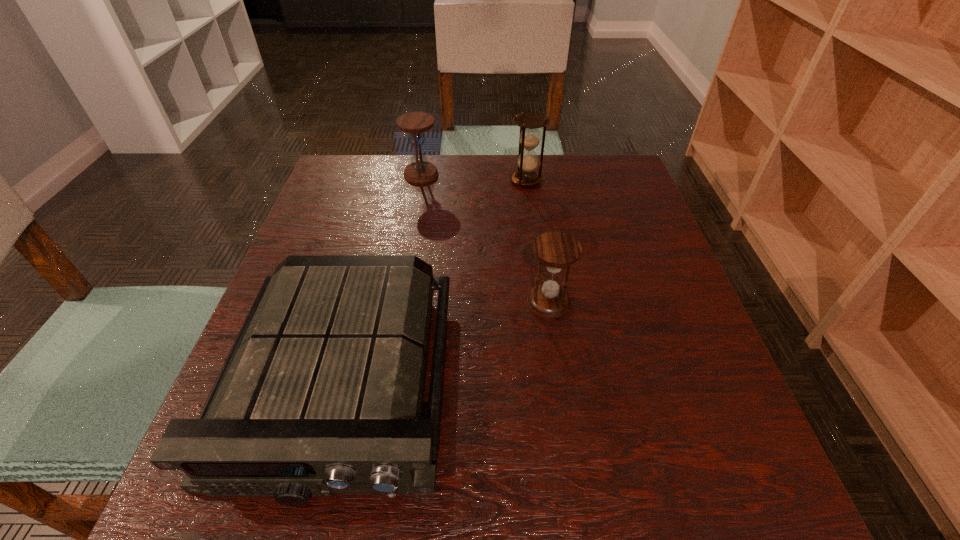
This screenshot has height=540, width=960. I want to click on the leftmost hourglass, so click(x=420, y=171).

Where is `the nearest hourglass`? This screenshot has width=960, height=540. the nearest hourglass is located at coordinates (556, 250).

Where is `radio receiver`? Image resolution: width=960 pixels, height=540 pixels. radio receiver is located at coordinates (321, 393).

You are a GUI agent. You are given a task and a screenshot of the screen. Output one action in this format:
    pyautogui.click(x=<x>, y=<y>)
    Task: Click on the vacant space located 0.350m on the right of the leftmost hourglass
    Image resolution: width=960 pixels, height=540 pixels.
    Given the screenshot: What is the action you would take?
    pyautogui.click(x=566, y=174)

Locate an element on the screen. The width and height of the screenshot is (960, 540). vacant area situated 0.250m on the left of the nearest hourglass is located at coordinates (400, 303).

The width and height of the screenshot is (960, 540). I want to click on object located at the near edge, so click(x=321, y=393).

At what (x,y) coordinates should I click in order to perform the action: click on object that is at the left edge. Please return your answer as a coordinate pair (x, y). This screenshot has height=540, width=960. Looking at the image, I should click on (321, 393).

You are a GUI agent. You are given a task and a screenshot of the screen. Output one action in this format:
    pyautogui.click(x=<x>, y=<y>)
    Task: Click on the object that is at the near left corner
    This screenshot has width=960, height=540.
    Given the screenshot: What is the action you would take?
    pyautogui.click(x=321, y=393)

In the image, there is a desktop. Where is `vacant space at the far edge`? vacant space at the far edge is located at coordinates (467, 158).

Where is `free spot at the left edge of the desktop`? This screenshot has height=540, width=960. free spot at the left edge of the desktop is located at coordinates (316, 209).